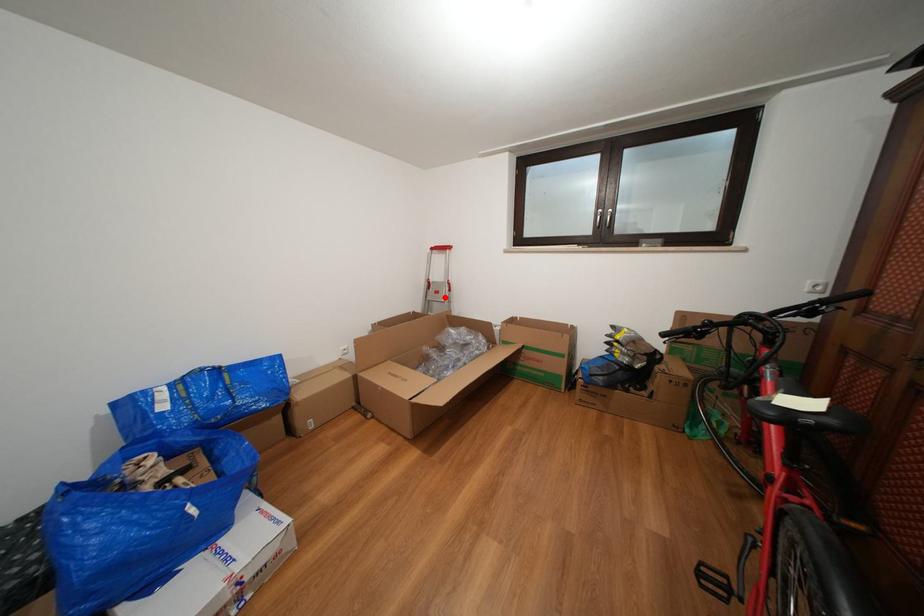
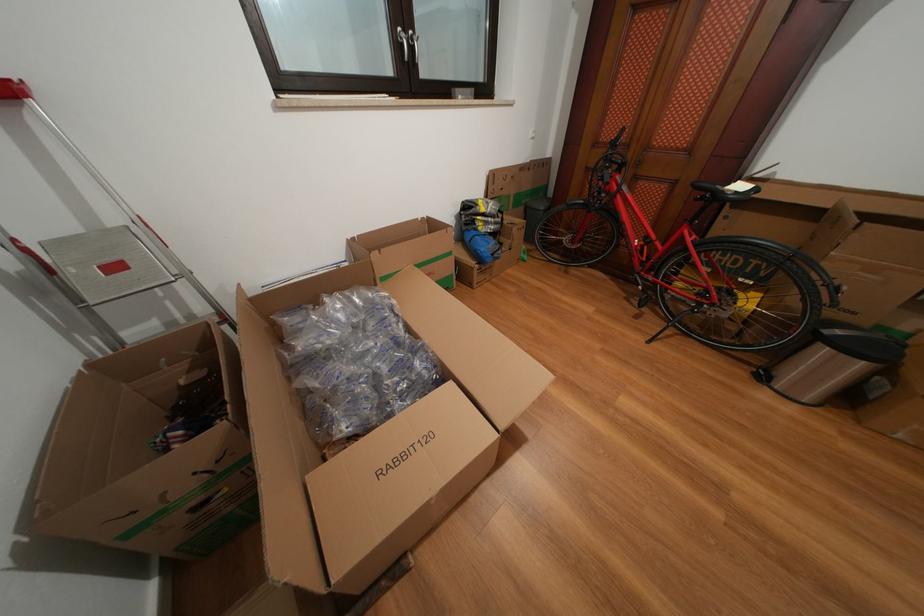
Question: I am providing you with two images of the same scene from different viewpoints. A red point is shown in image1. For the corresponding object point in image2, is it positioned nearer or farther from the camera?

Choices:
 (A) Nearer
 (B) Farther

Answer: (B)